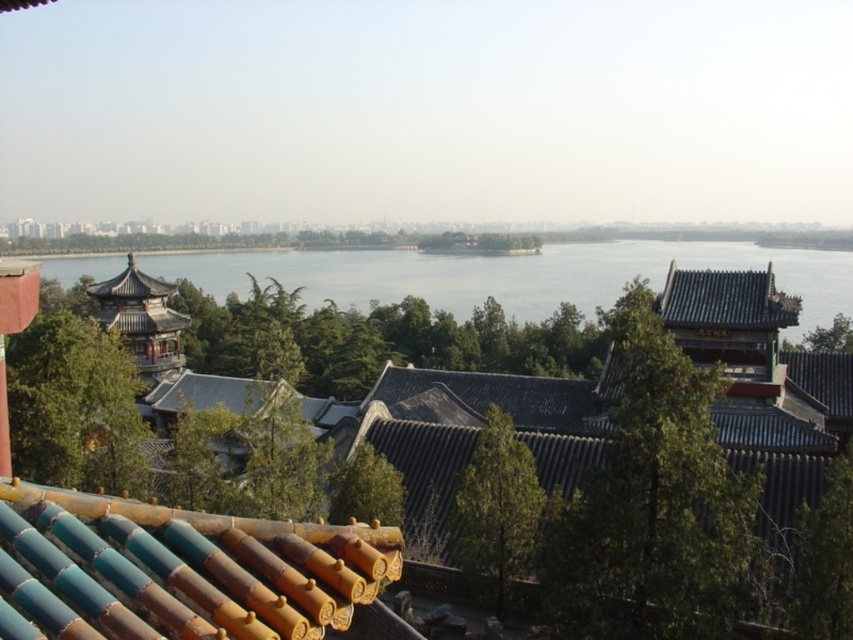
Between teal glazed tiles at center and blue water at center, which one has more height?

blue water at center is taller.

Who is more forward, [343,556] or [775,280]?

Point [343,556] is more forward.

At what (x,y) coordinates should I click in order to perform the action: click on teal glazed tiles at center. Please return your answer as a coordinate pair (x, y). The image size is (853, 640). Looking at the image, I should click on (177, 570).

Which of these two, teal glazed tiles at center or shiny dark blue tiled roof at upper right, stands shorter?

With less height is teal glazed tiles at center.

Where is `teal glazed tiles at center`? teal glazed tiles at center is located at coordinates (177, 570).

Does blue water at center appear on the left side of shiny dark blue tiled roof at upper right?

Indeed, blue water at center is positioned on the left side of shiny dark blue tiled roof at upper right.

Who is taller, blue water at center or shiny dark blue tiled roof at upper right?

blue water at center

Between point (689, 264) and point (724, 285), which one is positioned behind?

The point (689, 264) is more distant.

Where is `blue water at center`? The height and width of the screenshot is (640, 853). blue water at center is located at coordinates (512, 275).